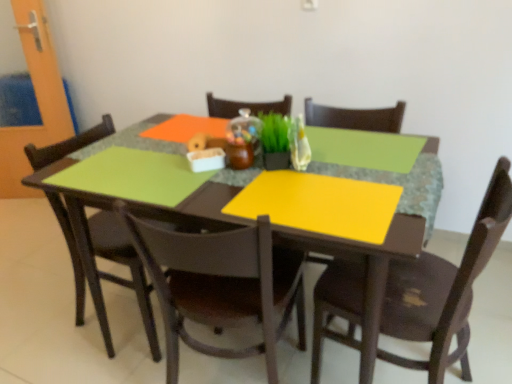
Question: Is yellow matte placemat at center oriented towards matte brown chair at center, which is counted as the 2th chair, starting from the right?

Choices:
 (A) no
 (B) yes

Answer: (B)

Question: Can you confirm if yellow matte placemat at center is positioned to the right of matte brown chair at center, which is counted as the 2th chair, starting from the right?

Choices:
 (A) no
 (B) yes

Answer: (B)

Question: Is yellow matte placemat at center bigger than matte brown chair at center, which ranks as the second chair in left-to-right order?

Choices:
 (A) yes
 (B) no

Answer: (A)

Question: From a real-world perspective, is yellow matte placemat at center physically above matte brown chair at center, which ranks as the second chair in left-to-right order?

Choices:
 (A) yes
 (B) no

Answer: (A)

Question: From the image's perspective, does yellow matte placemat at center appear higher than matte brown chair at center, which is counted as the 2th chair, starting from the right?

Choices:
 (A) yes
 (B) no

Answer: (A)

Question: Considering the relative sizes of yellow matte placemat at center and matte brown chair at center, which is counted as the 2th chair, starting from the right, in the image provided, is yellow matte placemat at center shorter than matte brown chair at center, which is counted as the 2th chair, starting from the right,?

Choices:
 (A) yes
 (B) no

Answer: (B)

Question: From a real-world perspective, is matte brown chair at left, which ranks as the third chair in right-to-left order, positioned over yellow matte placemat at center based on gravity?

Choices:
 (A) yes
 (B) no

Answer: (B)

Question: Is matte brown chair at left, the 1th chair positioned from the left, beside yellow matte placemat at center?

Choices:
 (A) yes
 (B) no

Answer: (B)

Question: From the image's perspective, would you say matte brown chair at left, the 1th chair positioned from the left, is shown under yellow matte placemat at center?

Choices:
 (A) yes
 (B) no

Answer: (A)

Question: Does matte brown chair at left, the 1th chair positioned from the left, come in front of yellow matte placemat at center?

Choices:
 (A) no
 (B) yes

Answer: (B)

Question: Is matte brown chair at left, the 1th chair positioned from the left, turned away from yellow matte placemat at center?

Choices:
 (A) yes
 (B) no

Answer: (B)

Question: Does matte brown chair at left, which ranks as the third chair in right-to-left order, appear on the left side of yellow matte placemat at center?

Choices:
 (A) yes
 (B) no

Answer: (A)

Question: Considering the relative sizes of matte brown chair at center, which is counted as the 2th chair, starting from the right, and green matte plant at center in the image provided, is matte brown chair at center, which is counted as the 2th chair, starting from the right, smaller than green matte plant at center?

Choices:
 (A) no
 (B) yes

Answer: (A)